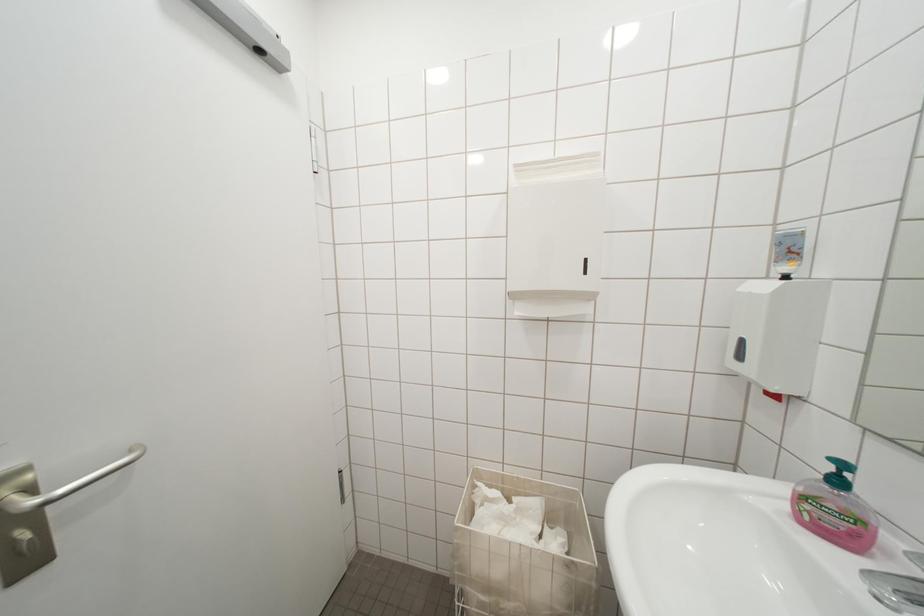
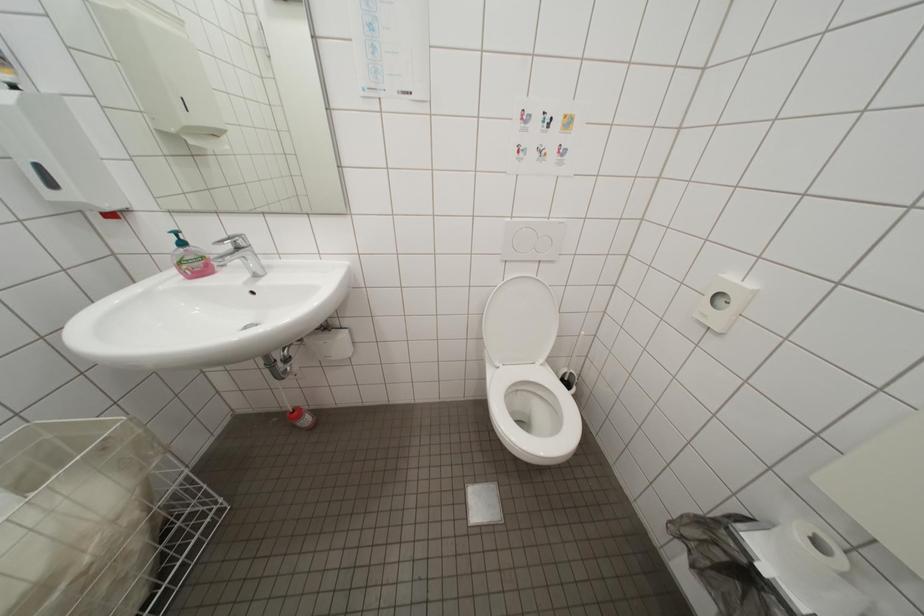
Consider the image. First-person continuous shooting, in which direction is the camera rotating?

The camera rotated toward right-down.